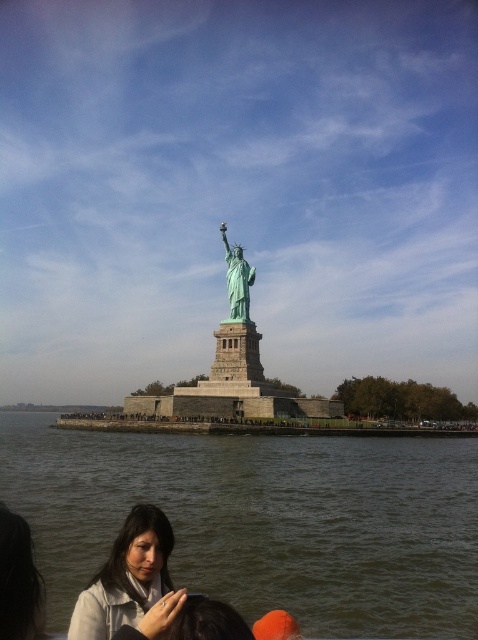
Which is below, green stone water at lower center or green patina statue at center?

green stone water at lower center

Is green stone water at lower center taller than green patina statue at center?

No.

In order to click on green stone water at lower center in this screenshot , I will do `click(262, 520)`.

Who is lower down, dark brown hair at lower left or green patina statue at center?

dark brown hair at lower left

Consider the image. Between dark brown hair at lower left and green patina statue at center, which one has less height?

Standing shorter between the two is dark brown hair at lower left.

Who is more distant from viewer, (21, 632) or (251, 278)?

The point (251, 278) is behind.

You are a GUI agent. You are given a task and a screenshot of the screen. Output one action in this format:
    pyautogui.click(x=<x>, y=<y>)
    Task: Click on the dark brown hair at lower left
    The height and width of the screenshot is (640, 478).
    Given the screenshot: What is the action you would take?
    pyautogui.click(x=19, y=580)

From the picture: Does matte gray jacket at lower left appear over dark brown hair at lower left?

No.

Is point (107, 582) closer to viewer compared to point (32, 624)?

No, (107, 582) is further to viewer.

Locate an element on the screen. The image size is (478, 640). matte gray jacket at lower left is located at coordinates (127, 577).